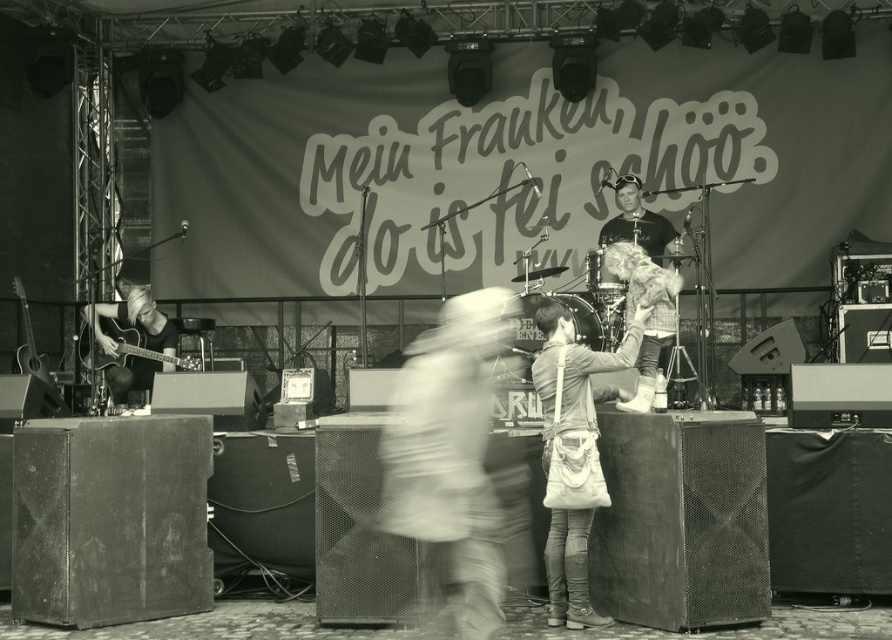
Is leather jacket at center to the left of metallic silver guitar at left from the viewer's perspective?

In fact, leather jacket at center is to the right of metallic silver guitar at left.

Who is lower down, leather jacket at center or metallic silver guitar at left?

leather jacket at center is lower down.

Who is more forward, (566, 394) or (22, 324)?

Point (566, 394)

The image size is (892, 640). I want to click on leather jacket at center, so click(x=575, y=376).

Which is in front, point (432, 460) or point (125, 352)?

Point (432, 460) is more forward.

Who is more distant from viewer, (484, 339) or (105, 337)?

The point (105, 337) is behind.

Is point (428, 364) positioned before point (161, 353)?

Yes, it is in front of point (161, 353).

Locate an element on the screen. The height and width of the screenshot is (640, 892). smooth white shirt at center is located at coordinates (451, 456).

Who is taller, smooth white shirt at center or matte black shirt at center?

smooth white shirt at center

The height and width of the screenshot is (640, 892). Describe the element at coordinates (451, 456) in the screenshot. I see `smooth white shirt at center` at that location.

Measure the distance between point (458,452) and camera.

The distance of point (458,452) from camera is 16.14 feet.

Find the location of a particular element. smooth white shirt at center is located at coordinates (451, 456).